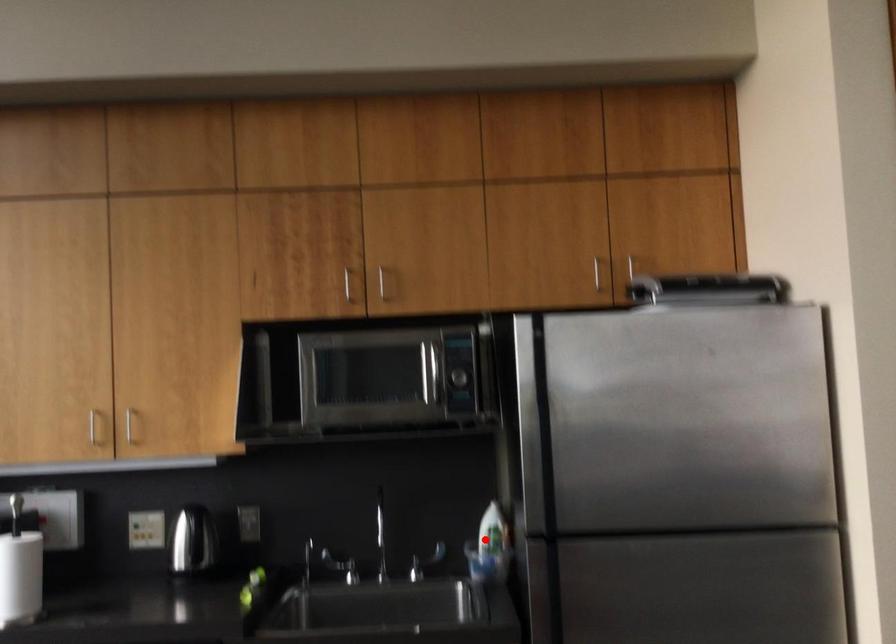
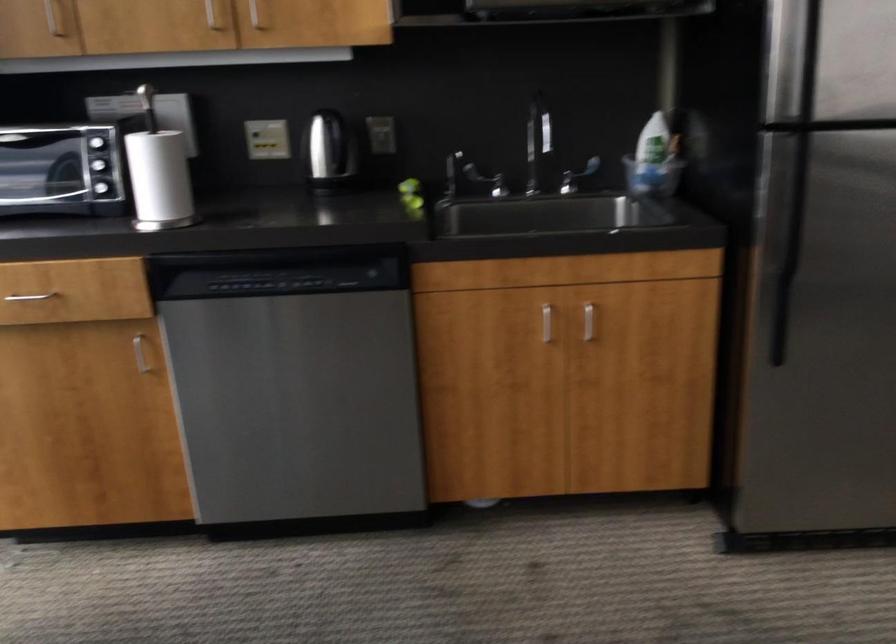
Find the pixel in the second image that matches the highlighted location in the first image.

(650, 155)